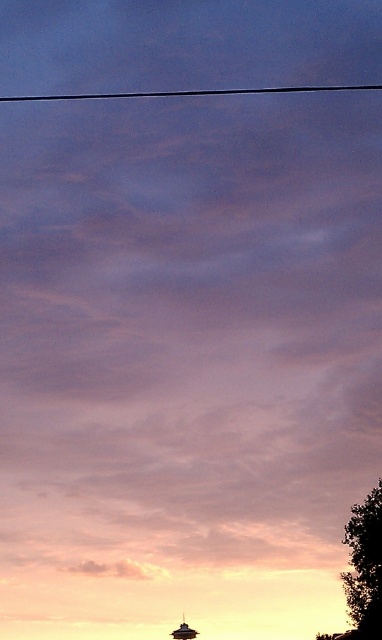
You are a bird flying in the sky and you see the black wire at upper center and the metallic silver boat at lower center. Which object is closer to you?

The black wire at upper center is closer to you because it is in front of the metallic silver boat at lower center.

You are an architect designing a new park and want to place a bench in the scene. The bench must be placed between the green leafy tree at right and the black wire at upper center. Which object should the bench be closer to to ensure it fits within the space?

The bench should be placed closer to the green leafy tree at right because it is thinner than the black wire at upper center, allowing more space between them for the bench.